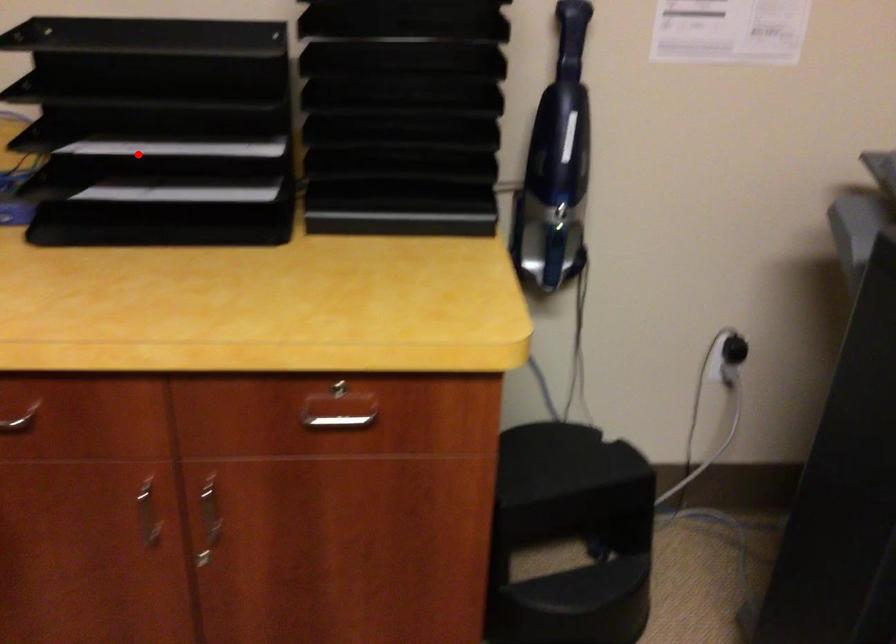
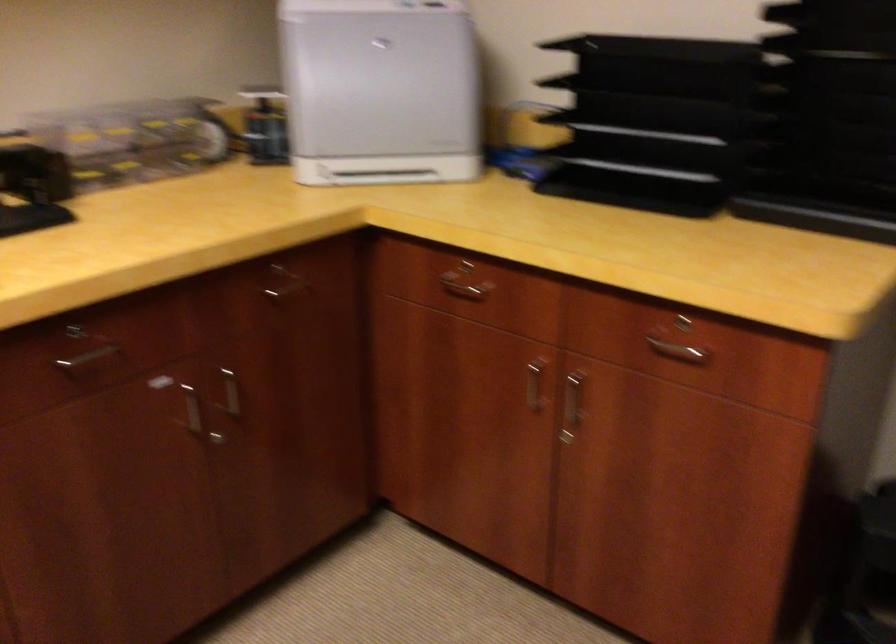
Question: A red point is marked in image1. In image2, is the corresponding 3D point closer to the camera or farther? Reply with the corresponding letter.

Choices:
 (A) The corresponding 3D point is closer.
 (B) The corresponding 3D point is farther.

Answer: (B)